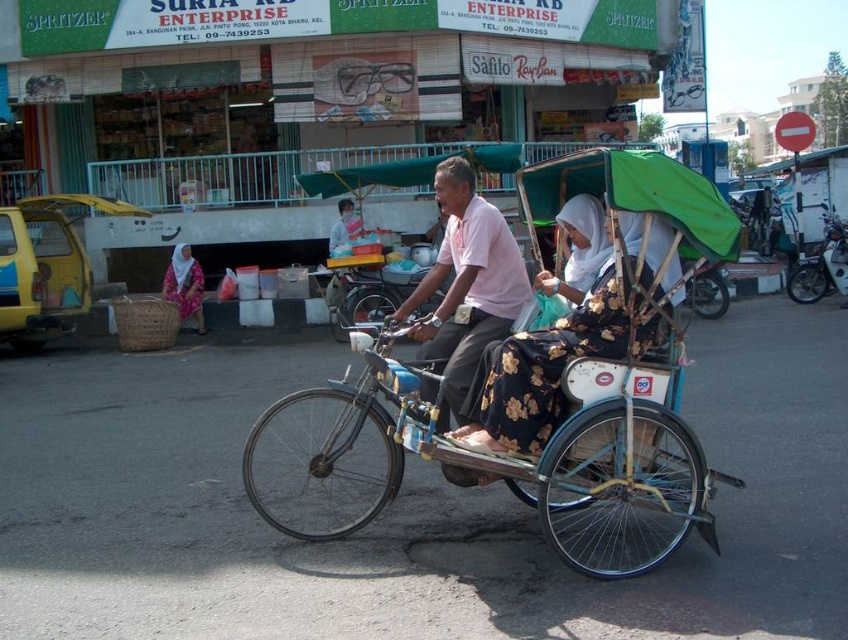
Question: Which point is farther from the camera taking this photo?

Choices:
 (A) (462, 228)
 (B) (584, 506)
 (C) (506, 358)
 (D) (813, 273)

Answer: (D)

Question: Which object appears closest to the camera in this image?

Choices:
 (A) pink cotton shirt at center
 (B) blue painted wood tricycle at center
 (C) white glossy motorbike at right

Answer: (B)

Question: Among these points, which one is nearest to the camera?

Choices:
 (A) (589, 317)
 (B) (843, 291)
 (C) (503, 288)

Answer: (A)

Question: Is blue painted wood tricycle at center smaller than pink cotton shirt at center?

Choices:
 (A) yes
 (B) no

Answer: (B)

Question: Is pink cotton shirt at center positioned at the back of floral fabric headscarf at lower left?

Choices:
 (A) yes
 (B) no

Answer: (B)

Question: Can you confirm if pink cotton shirt at center is positioned to the right of white glossy motorbike at right?

Choices:
 (A) no
 (B) yes

Answer: (A)